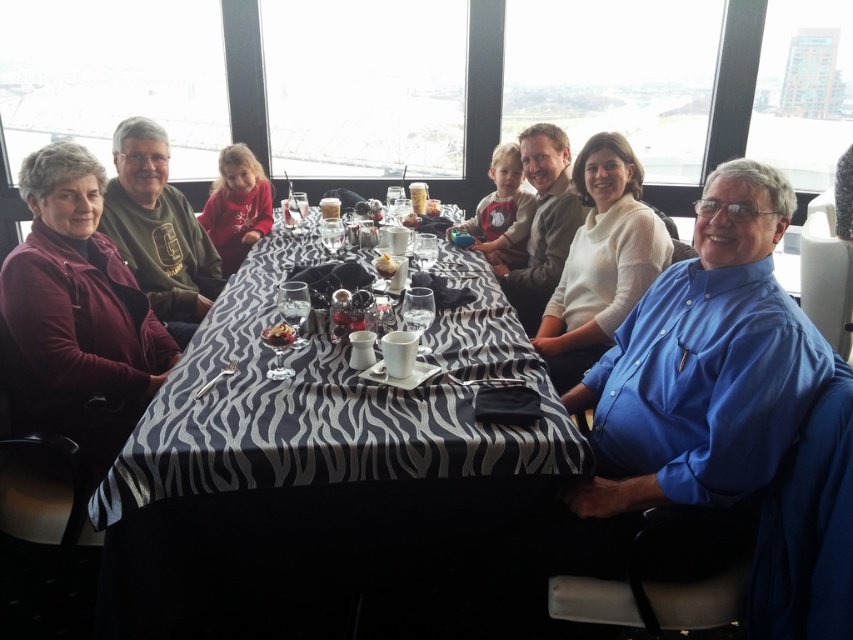
Question: Which point is closer to the camera?

Choices:
 (A) (223, 212)
 (B) (393, 266)

Answer: (B)

Question: Which point is closer to the camera?

Choices:
 (A) matte brown pastry at center
 (B) red cotton shirt at center
 (C) zebra-patterned tablecloth at center

Answer: (C)

Question: Based on their relative distances, which object is nearer to the red cotton shirt at center?

Choices:
 (A) matte brown pastry at center
 (B) white sweater at center
 (C) zebra-patterned tablecloth at center

Answer: (C)

Question: Is red cotton shirt at center bigger than smooth chocolate cake at center?

Choices:
 (A) yes
 (B) no

Answer: (A)

Question: In this image, where is matte brown pastry at center located relative to white crumbly cake at center?

Choices:
 (A) right
 (B) left

Answer: (B)

Question: Does red cotton shirt at center appear over white crumbly cake at center?

Choices:
 (A) no
 (B) yes

Answer: (B)